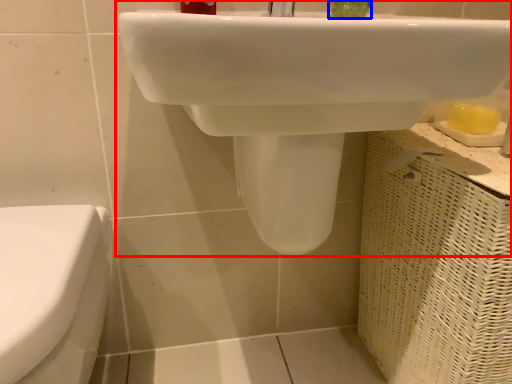
Question: Which object appears closest to the camera in this image, sink (highlighted by a red box) or liquid (highlighted by a blue box)?

Choices:
 (A) sink
 (B) liquid

Answer: (A)